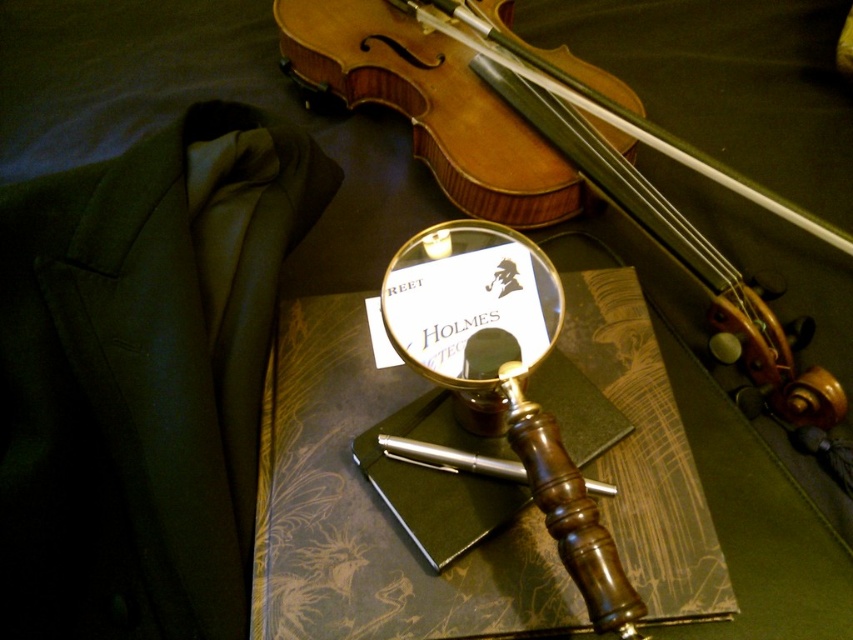
You are a photographer taking a closeup shot of the violin and the magnifying glass. The camera is positioned at the same level as the objects. Which of the two points, point [344,88] or point [438,225], is closer to the camera?

Point [344,88] is closer to the camera because it is further to the camera than point [438,225].

You are a detective examining the scene. You need to move the gold polished magnifying glass at center to the right to inspect something. Can you move it past the wooden violin at upper center without touching it?

The wooden violin at upper center is to the right of the gold polished magnifying glass at center, so moving the magnifying glass to the right would bring it closer to the violin. Since they are positioned side by side horizontally, moving the magnifying glass further right beyond the violin might not be possible without overlapping or going beyond the frame. Therefore, you cannot move the magnifying glass past the wooden violin at upper center without touching it.

You are a detective examining the scene. The wooden violin at upper center and the gold polished magnifying glass at center are both important clues. How far apart are these two items?

The wooden violin at upper center is 14.33 inches from the gold polished magnifying glass at center.